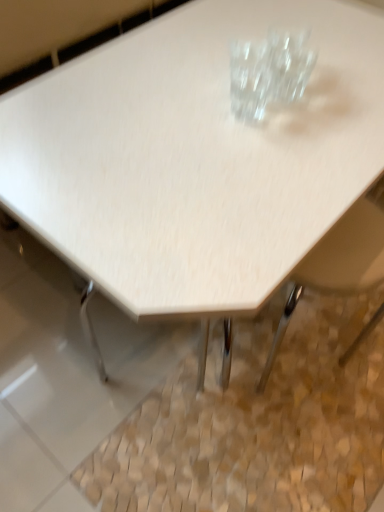
At what (x,y) coordinates should I click in order to perform the action: click on vacant space behind metallic silver chair at lower right. Please return your answer as a coordinate pair (x, y). This screenshot has width=384, height=512. Looking at the image, I should click on pyautogui.click(x=299, y=317).